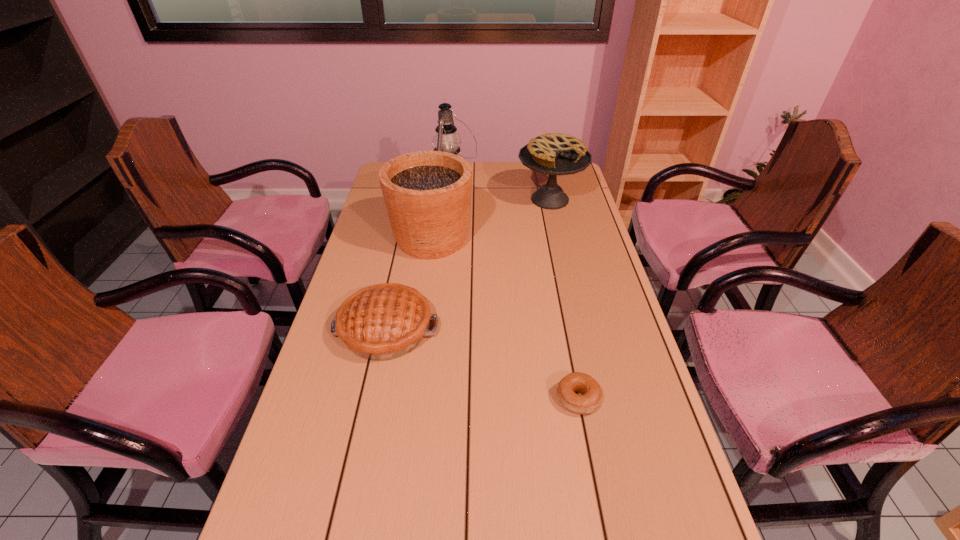
Identify which object is the closest to the taller pie. Please provide its 2D coordinates. Your answer should be formatted as a tuple, i.e. [(x, y)], where the tuple contains the x and y coordinates of a point satisfying the conditions above.

[(446, 140)]

The height and width of the screenshot is (540, 960). What are the coordinates of `the second closest object to the nearest object` in the screenshot? It's located at (427, 194).

You are a GUI agent. You are given a task and a screenshot of the screen. Output one action in this format:
    pyautogui.click(x=<x>, y=<y>)
    Task: Click on the free location that satisfies the following two spatial constraints: 1. on the front side of the flowerpot; 2. on the left side of the bagel
    
    Given the screenshot: What is the action you would take?
    pyautogui.click(x=409, y=399)